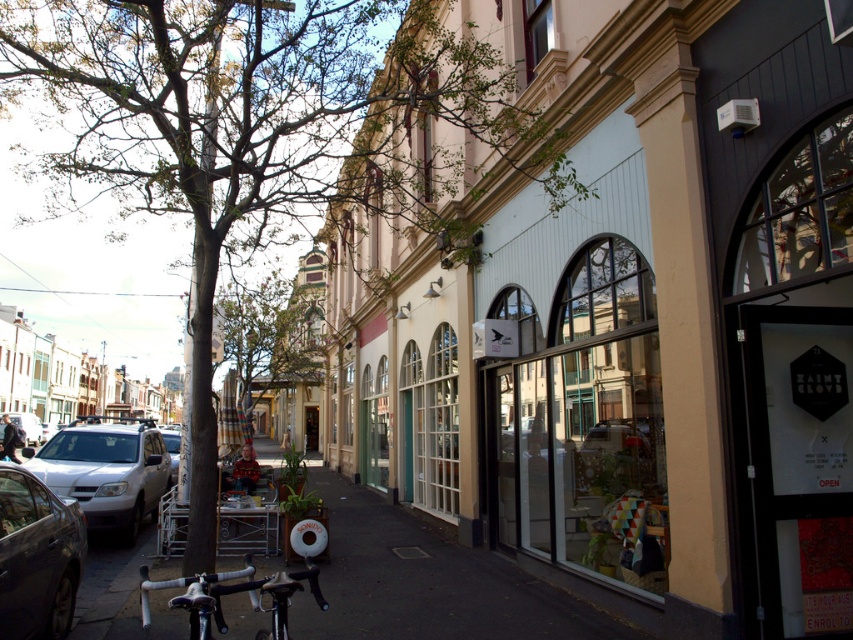
Question: Can you confirm if white matte suv at center-left is positioned below white matte car at center?

Choices:
 (A) no
 (B) yes

Answer: (A)

Question: Which of the following is the farthest from the observer?

Choices:
 (A) (132, 460)
 (B) (21, 426)
 (C) (202, 33)

Answer: (B)

Question: Can you confirm if white matte suv at center-left is wider than white matte car at center?

Choices:
 (A) yes
 (B) no

Answer: (A)

Question: Is dark gray asphalt at center positioned in front of shiny silver car at lower left?

Choices:
 (A) yes
 (B) no

Answer: (B)

Question: Among these objects, which one is farthest from the camera?

Choices:
 (A) white matte car at left
 (B) green leafy tree at center

Answer: (A)

Question: Which of the following is the farthest from the observer?

Choices:
 (A) (21, 596)
 (B) (442, 637)

Answer: (B)